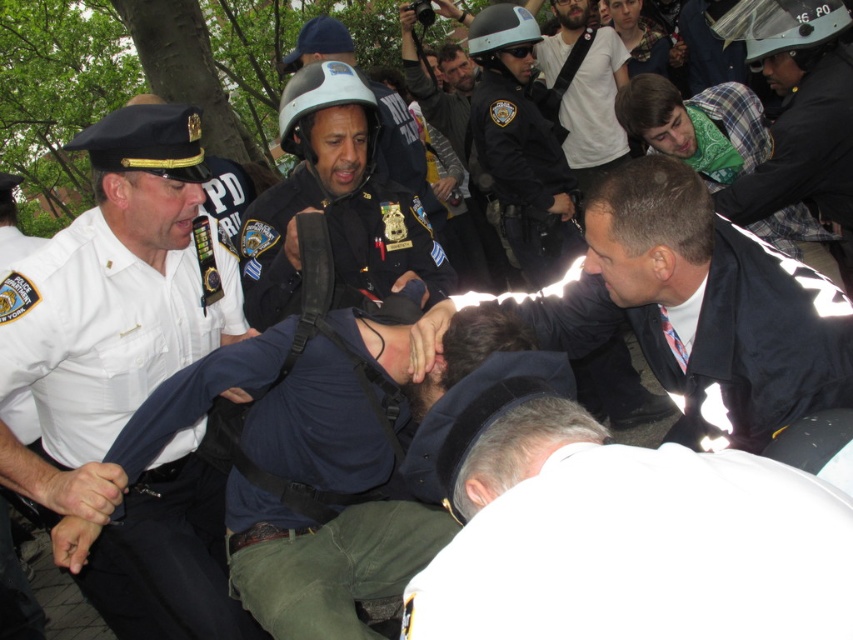
Question: Does white uniform shirt at left have a smaller size compared to matte black helmet at center?

Choices:
 (A) yes
 (B) no

Answer: (B)

Question: Can you confirm if white uniform shirt at left is bigger than white shirt at center?

Choices:
 (A) no
 (B) yes

Answer: (B)

Question: Which object is closer to the camera taking this photo?

Choices:
 (A) white matte shirt at lower center
 (B) matte black helmet at center
 (C) white shirt at center

Answer: (A)

Question: Estimate the real-world distances between objects in this image. Which object is closer to the white shirt at center?

Choices:
 (A) white matte shirt at lower center
 (B) white uniform shirt at left
 (C) dark blue shirt at center
 (D) matte black helmet at center

Answer: (A)

Question: Does dark blue shirt at center have a larger size compared to matte black helmet at center?

Choices:
 (A) yes
 (B) no

Answer: (B)

Question: Which object is positioned closest to the white matte shirt at lower center?

Choices:
 (A) dark blue shirt at center
 (B) white shirt at center
 (C) matte black helmet at center

Answer: (B)